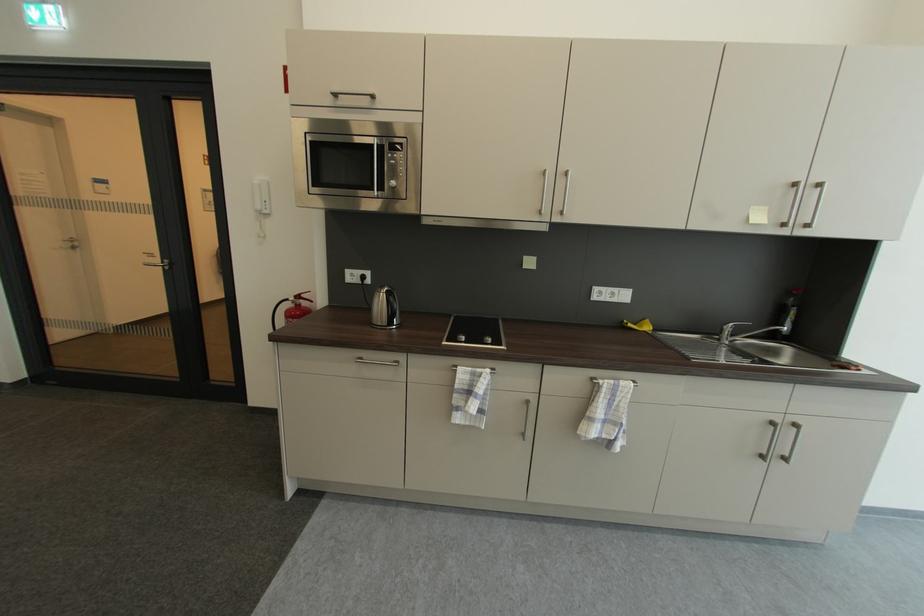
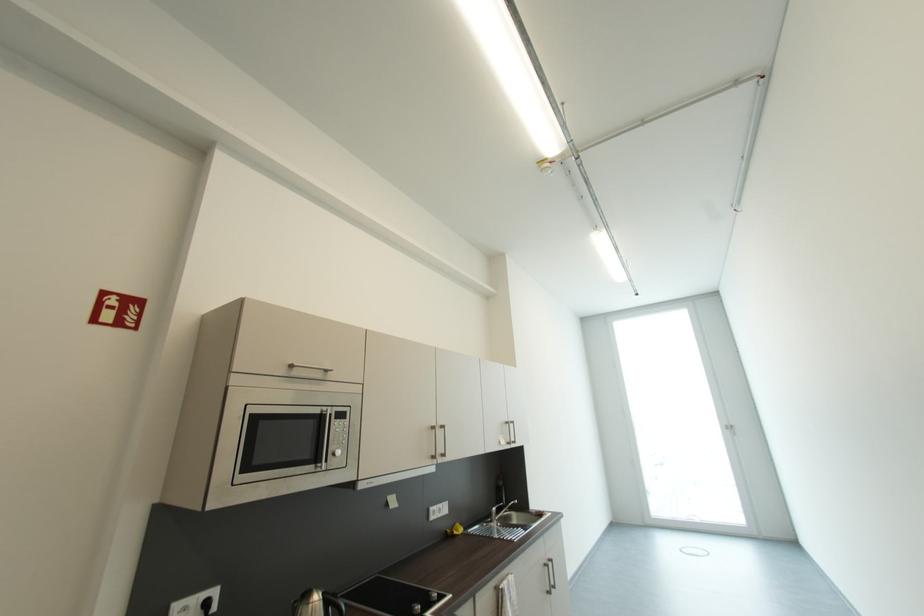
Question: I am providing you with two images of the same scene from different viewpoints. After the viewpoint changes to image2, which objects are now occluded?

Choices:
 (A) white power outlet
 (B) black stovetop knob
 (C) white door handle
 (D) none of these

Answer: (D)